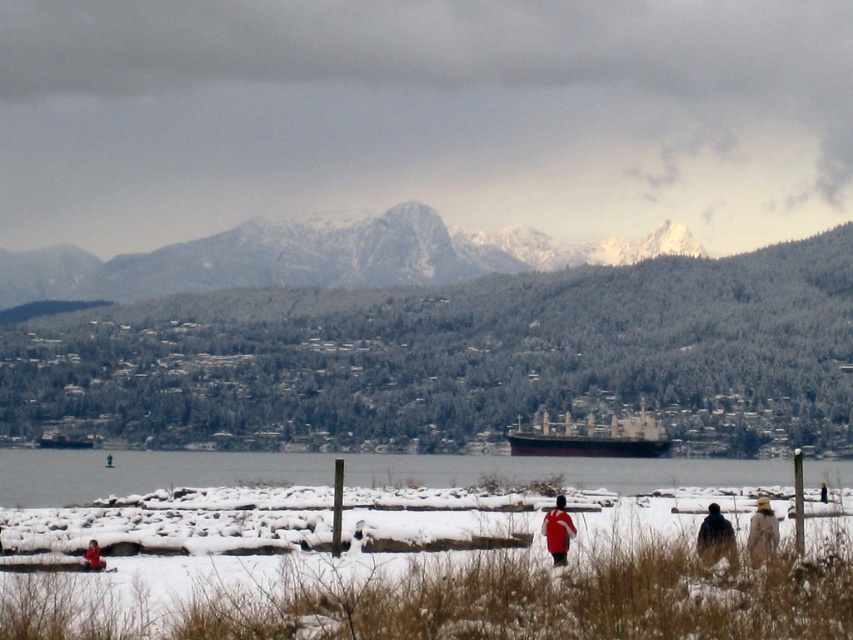
Is point (474, 401) positioned after point (55, 480)?

That is True.

Which is in front, point (572, 355) or point (227, 456)?

Point (227, 456) is more forward.

What are the coordinates of `snowy forested mountain at center` in the screenshot? It's located at tap(457, 358).

Where is `snowy forested mountain at center`? Image resolution: width=853 pixels, height=640 pixels. snowy forested mountain at center is located at coordinates (457, 358).

Does snowy granite mountain at upper center appear under red matte jacket at lower center?

No.

Is snowy granite mountain at upper center above red matte jacket at lower center?

Correct, snowy granite mountain at upper center is located above red matte jacket at lower center.

Where is `snowy granite mountain at upper center`? The height and width of the screenshot is (640, 853). snowy granite mountain at upper center is located at coordinates (317, 259).

Does snowy granite mountain at upper center have a greater width compared to clear water at lower center?

In fact, snowy granite mountain at upper center might be narrower than clear water at lower center.

Between snowy granite mountain at upper center and clear water at lower center, which one has less height?

clear water at lower center is shorter.

Find the location of a particular element. The height and width of the screenshot is (640, 853). snowy granite mountain at upper center is located at coordinates (317, 259).

Identify the location of snowy granite mountain at upper center. This screenshot has height=640, width=853. [x=317, y=259].